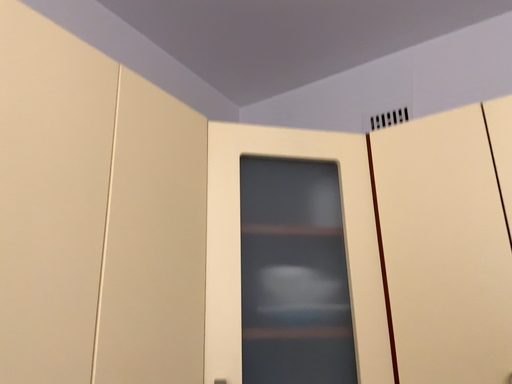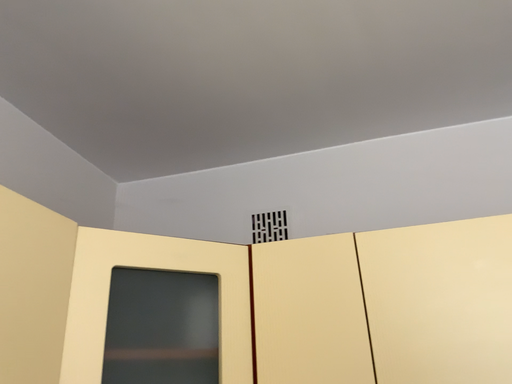
Question: How did the camera likely rotate when shooting the video?

Choices:
 (A) rotated right
 (B) rotated left

Answer: (A)